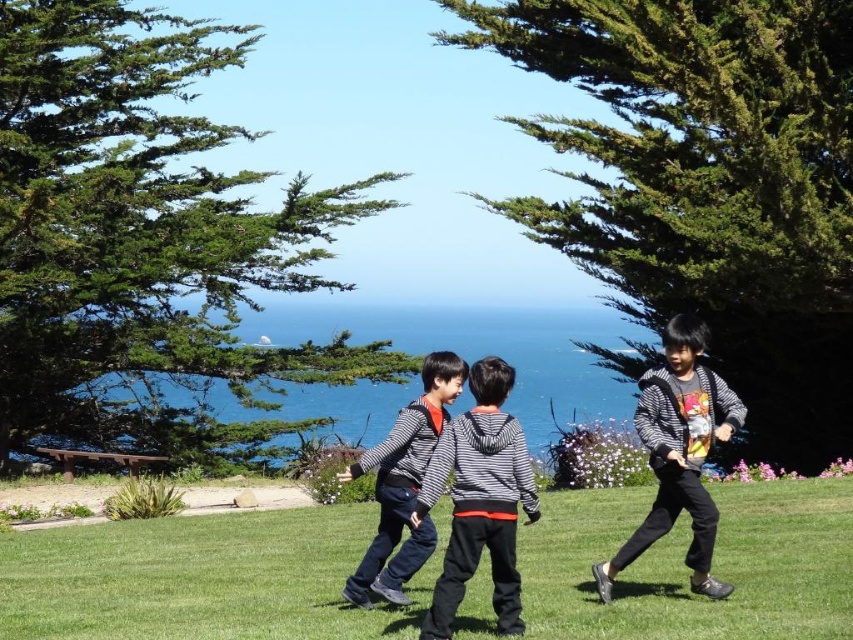
You are a photographer trying to capture a group photo of the children wearing the striped cotton hoodie at center and the striped sweater at right. Since you want to ensure that both outfits are clearly visible in the photo, which child should you position closer to the camera to avoid any overlap?

The striped cotton hoodie at center is narrower than the striped sweater at right, so positioning the child wearing the striped cotton hoodie at center closer to the camera will help prevent overlap since it takes up less space.